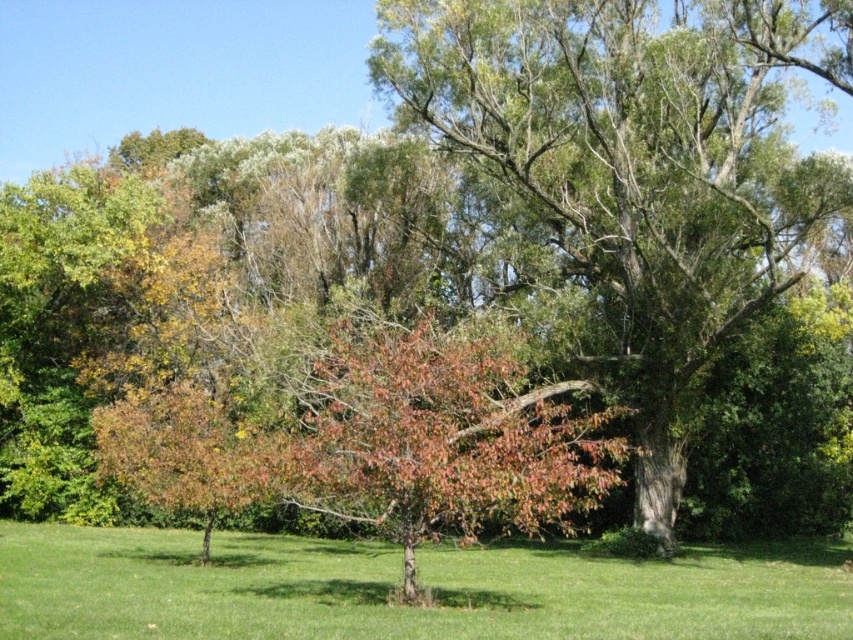
You are standing in the outdoor scene and want to place a small garden decoration between the two points, point (503, 134) and point (486, 605). Which point should the decoration be closer to in order to appear closer to the viewer?

The decoration should be closer to point (503, 134) because it is further to the camera than point (486, 605), so positioning it near that point would make it appear closer to the viewer.

You are planning to plant a new tree in your garden. You have a small sapling that requires a space of at least 2 meters in diameter. Looking at the image, can the green leafy tree at center and the green grass at center accommodate this sapling without overcrowding?

The green leafy tree at center is larger in size than the green grass at center. However, since the grass is part of the ground cover, the available space for planting would depend on the actual dimensions of the area. The question mentions needing a 2m diameter space. Since the scene description mentions the grass is well maintained and lush, it might have sufficient space. But without specific measurements, it is hard to determine. However, the tree being larger does not directly indicate the spacing. The